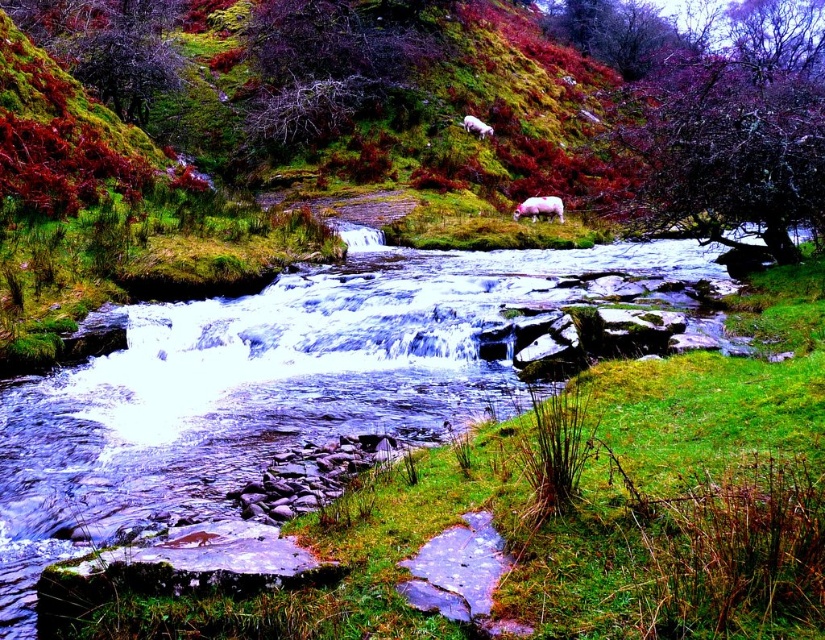
Question: Based on their relative distances, which object is farther from the white woolly sheep at center-right?

Choices:
 (A) green mossy tree at upper left
 (B) white woolly sheep at upper center

Answer: (A)

Question: Which of these objects is positioned closest to the dark purple textured branch at upper center?

Choices:
 (A) white woolly sheep at center-right
 (B) green grass at center
 (C) green mossy tree at upper left

Answer: (C)

Question: Which point is closer to the camera?

Choices:
 (A) green grass at center
 (B) white woolly sheep at upper center

Answer: (A)

Question: Can you confirm if green grass at center is positioned above purple leafy tree at upper right?

Choices:
 (A) yes
 (B) no

Answer: (B)

Question: From the image, what is the correct spatial relationship of green mossy tree at upper left in relation to white woolly sheep at upper center?

Choices:
 (A) right
 (B) left

Answer: (B)

Question: Does purple leafy tree at upper right have a smaller size compared to white woolly sheep at upper center?

Choices:
 (A) no
 (B) yes

Answer: (A)